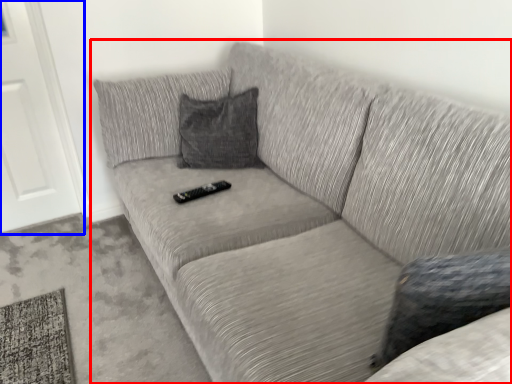
Question: Which object appears farthest to the camera in this image, studio couch (highlighted by a red box) or door (highlighted by a blue box)?

Choices:
 (A) studio couch
 (B) door

Answer: (B)